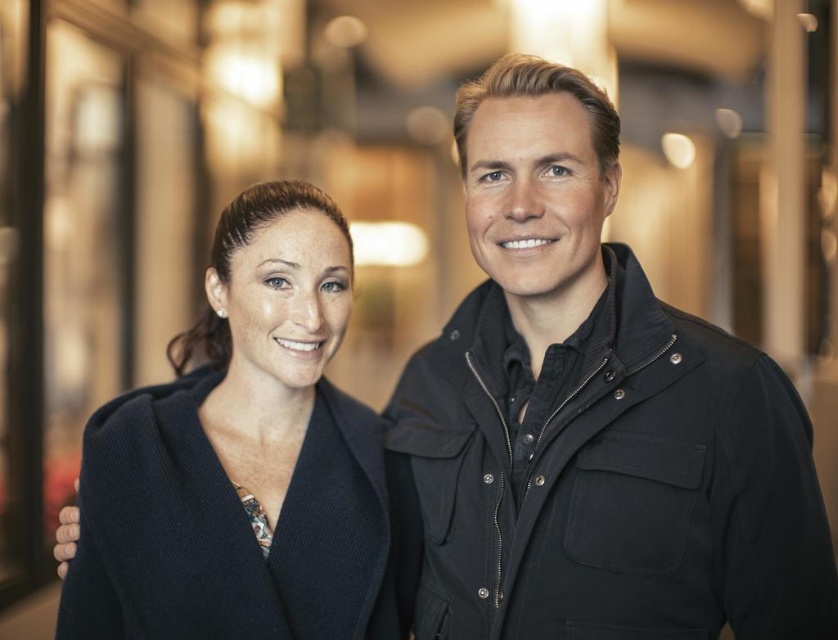
You are standing in the hallway and see the two people in the image. There is a point marked at coordinates (x=593, y=416). Which object in the scene is located exactly at this point?

The point at coordinates (x=593, y=416) marks the location of the black matte jacket at center.

You are a photographer standing 4 feet away from the black matte jacket at center. Can you adjust your position to ensure the jacket is in focus without moving the subjects?

The black matte jacket at center is 3.96 feet from camera. Since you are standing 4 feet away, you need to move 0.04 feet closer to align with the jacket distance for focus.